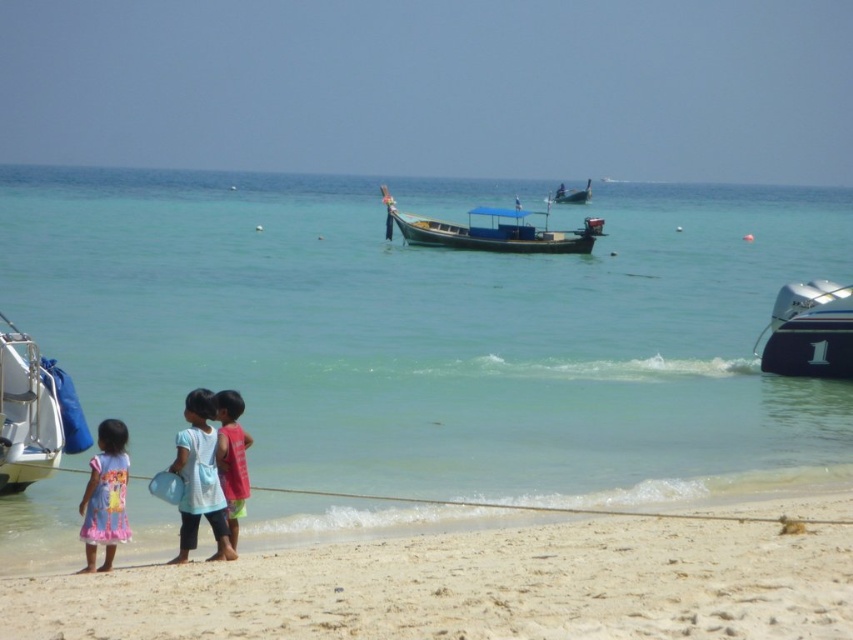
Can you confirm if clear blue water at center is positioned above wooden longboat at center?

No, clear blue water at center is not above wooden longboat at center.

Which is more to the right, clear blue water at center or wooden longboat at center?

From the viewer's perspective, wooden longboat at center appears more on the right side.

Does point (656, 200) lie in front of point (566, 189)?

No, (656, 200) is further to viewer.

Image resolution: width=853 pixels, height=640 pixels. In order to click on clear blue water at center in this screenshot , I will do `click(436, 330)`.

Who is more distant from viewer, (32, 433) or (230, 504)?

The point (32, 433) is behind.

Who is lower down, white matte boat at left or red cotton shirt at lower left?

Positioned lower is red cotton shirt at lower left.

Is point (0, 433) positioned in front of point (236, 528)?

That is False.

At what (x,y) coordinates should I click in order to perform the action: click on white matte boat at left. Please return your answer as a coordinate pair (x, y). Looking at the image, I should click on (25, 413).

In the scene shown: Does clear blue water at center have a greater height compared to white sandy beach at lower left?

Yes, clear blue water at center is taller than white sandy beach at lower left.

Is clear blue water at center positioned in front of white sandy beach at lower left?

No, clear blue water at center is further to the viewer.

Which is behind, point (451, 342) or point (300, 577)?

Point (451, 342)

The image size is (853, 640). In order to click on clear blue water at center in this screenshot , I will do `click(436, 330)`.